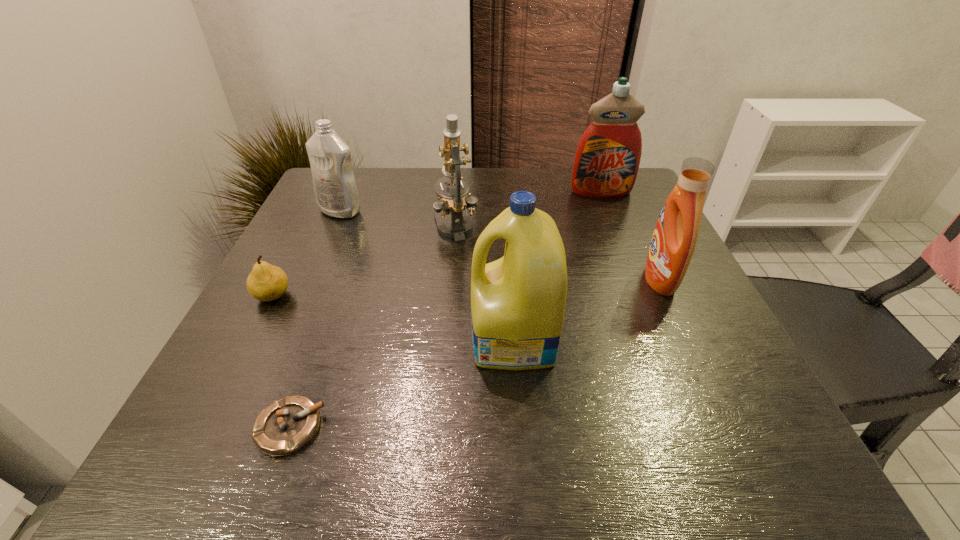
Where is `microscope that is at the far edge`? microscope that is at the far edge is located at coordinates (455, 201).

Where is `object that is at the near edge`? The height and width of the screenshot is (540, 960). object that is at the near edge is located at coordinates (284, 427).

Locate an element on the screen. detergent located in the left edge section of the desktop is located at coordinates (335, 188).

The height and width of the screenshot is (540, 960). Find the location of `pear that is at the left edge`. pear that is at the left edge is located at coordinates (266, 282).

You are a GUI agent. You are given a task and a screenshot of the screen. Output one action in this format:
    pyautogui.click(x=<x>, y=<y>)
    Task: Click on the ashtray present at the left edge
    The height and width of the screenshot is (540, 960).
    Given the screenshot: What is the action you would take?
    pyautogui.click(x=284, y=427)

In order to click on object at the far left corner in this screenshot , I will do `click(335, 188)`.

Image resolution: width=960 pixels, height=540 pixels. I want to click on object that is at the near left corner, so click(284, 427).

Find the location of `object situated at the far right corner`. object situated at the far right corner is located at coordinates (607, 159).

Find the location of a particular element. blank space at the far edge is located at coordinates (556, 180).

I want to click on vacant space at the left edge of the desktop, so click(x=313, y=334).